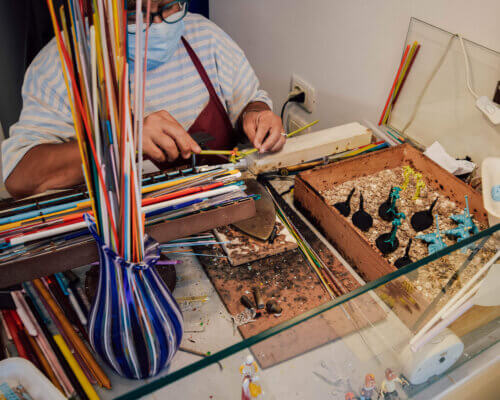
Find the location of a particular element. This screenshot has width=500, height=400. wooden box is located at coordinates (366, 253).